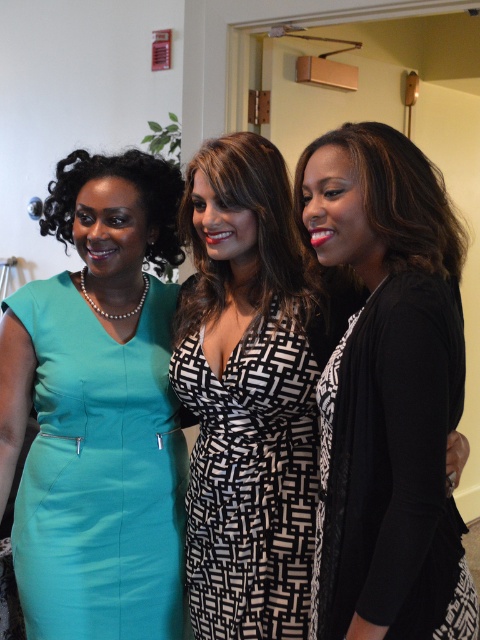
Can you confirm if black matte cardigan at right is positioned above black and white woven dress at center?

Yes.

Locate an element on the screen. black matte cardigan at right is located at coordinates (387, 392).

Does teal matte dress at left appear on the left side of black and white woven dress at center?

Correct, you'll find teal matte dress at left to the left of black and white woven dress at center.

Can you confirm if teal matte dress at left is positioned to the right of black and white woven dress at center?

In fact, teal matte dress at left is to the left of black and white woven dress at center.

Where is `teal matte dress at left`? teal matte dress at left is located at coordinates (99, 472).

Is black matte cardigan at right thinner than teal matte dress at left?

Indeed, black matte cardigan at right has a lesser width compared to teal matte dress at left.

Who is more forward, (388, 602) or (130, 620)?

Point (388, 602) is more forward.

What do you see at coordinates (387, 392) in the screenshot? I see `black matte cardigan at right` at bounding box center [387, 392].

At what (x,y) coordinates should I click in order to perform the action: click on black matte cardigan at right. Please return your answer as a coordinate pair (x, y). The image size is (480, 640). Looking at the image, I should click on (387, 392).